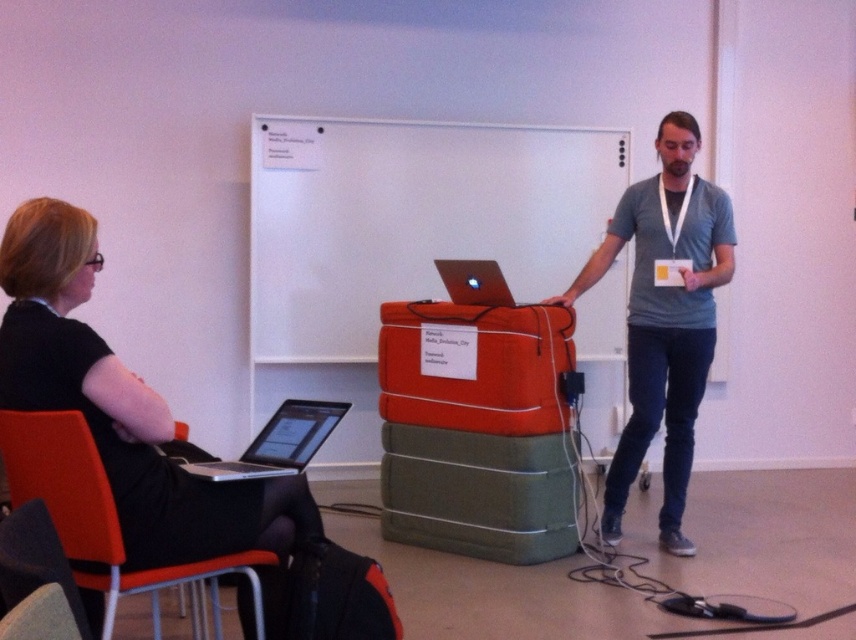
Does black fabric dress at left have a larger size compared to silver metallic laptop at lower left?

Indeed, black fabric dress at left has a larger size compared to silver metallic laptop at lower left.

Who is higher up, black fabric dress at left or silver metallic laptop at lower left?

Positioned higher is black fabric dress at left.

Is point (218, 529) positioned behind point (254, 461)?

No, it is not.

Locate an element on the screen. This screenshot has height=640, width=856. black fabric dress at left is located at coordinates (122, 406).

Can you confirm if gray cotton t-shirt at center is bigger than shiny silver laptop at center?

Indeed, gray cotton t-shirt at center has a larger size compared to shiny silver laptop at center.

Is point (632, 336) farther from camera compared to point (462, 289)?

No.

Is point (597, 266) closer to camera compared to point (474, 259)?

Yes, point (597, 266) is in front of point (474, 259).

You are a GUI agent. You are given a task and a screenshot of the screen. Output one action in this format:
    pyautogui.click(x=<x>, y=<y>)
    Task: Click on the gray cotton t-shirt at center
    The image size is (856, 640).
    Given the screenshot: What is the action you would take?
    pyautogui.click(x=664, y=317)

Is orange fabric suitcase at center thinner than shiny silver laptop at center?

No.

Is point (407, 369) positioned after point (498, 276)?

Yes, it is.

Is point (452, 340) less distant than point (450, 259)?

Yes, it is in front of point (450, 259).

This screenshot has width=856, height=640. I want to click on orange fabric suitcase at center, so click(474, 365).